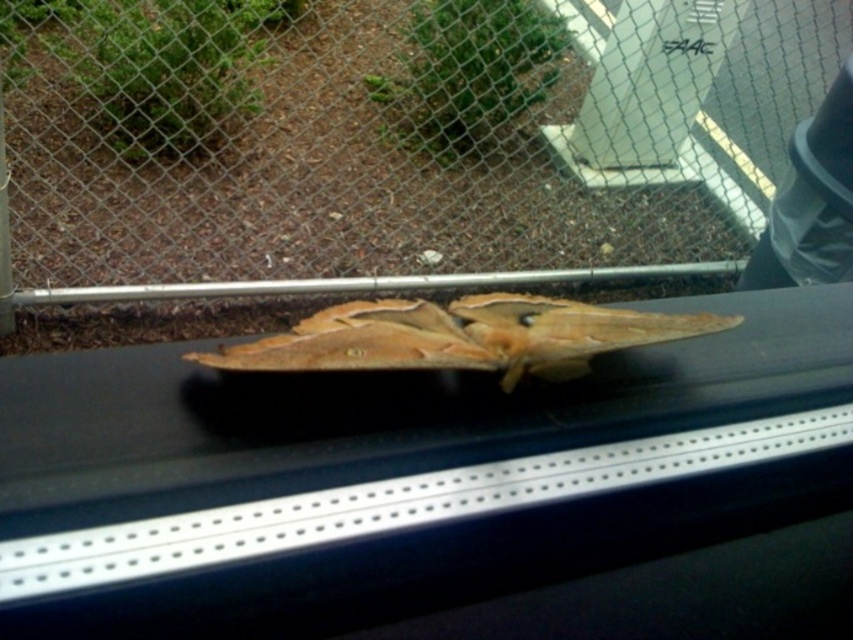
You are standing inside the building looking at the moth on the window sill. There are two points marked on the window sill. Which point is closer to you, point (675, 76) or point (563, 355)?

Point (675, 76) is closer to you than point (563, 355) because it is further to the viewer.

You are standing in front of a window where a large moth is resting. There is a point marked at coordinates (427, 150). Based on the scene description, where is this point located?

The point at (427, 150) is on the metal chain link fence at center.